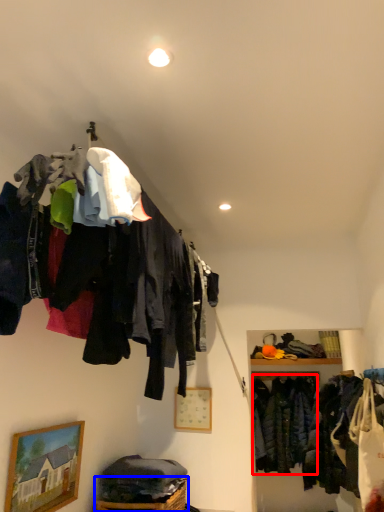
Question: Which object is closer to the camera taking this photo, clothing (highlighted by a red box) or basket (highlighted by a blue box)?

Choices:
 (A) clothing
 (B) basket

Answer: (B)